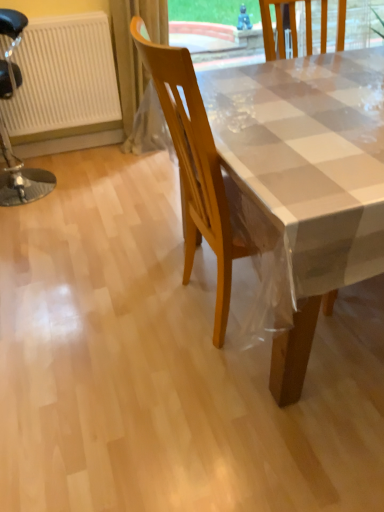
You are a GUI agent. You are given a task and a screenshot of the screen. Output one action in this format:
    pyautogui.click(x=<x>, y=<y>)
    Task: Click on the black leather stool at left, which is the 1th chair from left to right
    
    Given the screenshot: What is the action you would take?
    pyautogui.click(x=21, y=180)

Locate an element on the screen. The height and width of the screenshot is (512, 384). wooden chair at center, the first chair from the right is located at coordinates (192, 166).

The width and height of the screenshot is (384, 512). I want to click on white textured radiator at left, so click(63, 76).

Where is `black leather stool at left, which appears as the 1th chair when viewed from the back`? The width and height of the screenshot is (384, 512). black leather stool at left, which appears as the 1th chair when viewed from the back is located at coordinates (21, 180).

From the picture: Is wooden chair at center, the first chair from the right, to the left or to the right of black leather stool at left, placed as the 2th chair when sorted from front to back, in the image?

In the image, wooden chair at center, the first chair from the right, appears on the right side of black leather stool at left, placed as the 2th chair when sorted from front to back.

How many degrees apart are the facing directions of wooden chair at center, the second chair from the left, and black leather stool at left, placed as the 2th chair when sorted from front to back?

There is a 179-degree angle between the facing directions of wooden chair at center, the second chair from the left, and black leather stool at left, placed as the 2th chair when sorted from front to back.

Which is behind, wooden chair at center, which is counted as the second chair, starting from the back, or black leather stool at left, which is the 1th chair from left to right?

Positioned behind is black leather stool at left, which is the 1th chair from left to right.

Can we say wooden chair at center, the first chair from the right, lies outside black leather stool at left, which appears as the 1th chair when viewed from the back?

Indeed, wooden chair at center, the first chair from the right, is completely outside black leather stool at left, which appears as the 1th chair when viewed from the back.

Which is in front, point (55, 178) or point (202, 189)?

The point (202, 189) is in front.

From the image's perspective, is black leather stool at left, placed as the 2th chair when sorted from front to back, under wooden chair at center, which is counted as the second chair, starting from the back?

No, from the image's perspective, black leather stool at left, placed as the 2th chair when sorted from front to back, is not below wooden chair at center, which is counted as the second chair, starting from the back.

Looking at this image, can you confirm if black leather stool at left, positioned as the second chair in right-to-left order, is thinner than wooden chair at center, which is counted as the second chair, starting from the back?

Indeed, black leather stool at left, positioned as the second chair in right-to-left order, has a lesser width compared to wooden chair at center, which is counted as the second chair, starting from the back.

How much distance is there between black leather stool at left, which appears as the 1th chair when viewed from the back, and wooden chair at center, which is counted as the second chair, starting from the back?

They are 4.41 feet apart.

Is white textured radiator at left thinner than black leather stool at left, positioned as the second chair in right-to-left order?

Indeed, white textured radiator at left has a lesser width compared to black leather stool at left, positioned as the second chair in right-to-left order.

Can you confirm if white textured radiator at left is bigger than black leather stool at left, placed as the 2th chair when sorted from front to back?

Actually, white textured radiator at left might be smaller than black leather stool at left, placed as the 2th chair when sorted from front to back.

From a real-world perspective, is white textured radiator at left physically above black leather stool at left, which appears as the 1th chair when viewed from the back?

Yes, from a real-world perspective, white textured radiator at left is above black leather stool at left, which appears as the 1th chair when viewed from the back.

From the image's perspective, is white textured radiator at left under black leather stool at left, placed as the 2th chair when sorted from front to back?

No.

Which is behind, point (183, 274) or point (146, 83)?

The point (146, 83) is farther.

Is wooden chair at center, which is counted as the second chair, starting from the back, facing towards translucent plastic curtain at upper left?

No.

Is wooden chair at center, the first chair positioned from the front, to the left or to the right of translucent plastic curtain at upper left in the image?

From the image, it's evident that wooden chair at center, the first chair positioned from the front, is to the right of translucent plastic curtain at upper left.

Choose the correct answer: Is wooden chair at center, the second chair from the left, inside translucent plastic curtain at upper left or outside it?

wooden chair at center, the second chair from the left, is spatially situated outside translucent plastic curtain at upper left.

Is black leather stool at left, positioned as the second chair in right-to-left order, surrounded by translucent plastic curtain at upper left?

No, black leather stool at left, positioned as the second chair in right-to-left order, is not surrounded by translucent plastic curtain at upper left.

From a real-world perspective, is translucent plastic curtain at upper left physically above black leather stool at left, positioned as the second chair in right-to-left order?

Incorrect, from a real-world perspective, translucent plastic curtain at upper left is lower than black leather stool at left, positioned as the second chair in right-to-left order.

Which of these two, translucent plastic curtain at upper left or black leather stool at left, which is the 1th chair from left to right, stands taller?

Standing taller between the two is black leather stool at left, which is the 1th chair from left to right.

Does translucent plastic curtain at upper left touch black leather stool at left, positioned as the second chair in right-to-left order?

No, translucent plastic curtain at upper left is not making contact with black leather stool at left, positioned as the second chair in right-to-left order.

Looking at this image, is wooden chair at center, which is counted as the second chair, starting from the back, oriented away from white textured radiator at left?

No, white textured radiator at left is not at the back of wooden chair at center, which is counted as the second chair, starting from the back.

Is wooden chair at center, the second chair from the left, situated inside white textured radiator at left or outside?

wooden chair at center, the second chair from the left, exists outside the volume of white textured radiator at left.

From the picture: Is wooden chair at center, the second chair from the left, to the left of white textured radiator at left from the viewer's perspective?

Incorrect, wooden chair at center, the second chair from the left, is not on the left side of white textured radiator at left.

Looking at this image, can you tell me how much wooden chair at center, the second chair from the left, and white textured radiator at left differ in facing direction?

The angular difference between wooden chair at center, the second chair from the left, and white textured radiator at left is 93.4 degrees.

Considering their positions, is black leather stool at left, positioned as the second chair in right-to-left order, located in front of or behind white textured radiator at left?

Clearly, black leather stool at left, positioned as the second chair in right-to-left order, is in front of white textured radiator at left.

From the picture: Measure the distance between black leather stool at left, positioned as the second chair in right-to-left order, and white textured radiator at left.

black leather stool at left, positioned as the second chair in right-to-left order, is 17.71 inches away from white textured radiator at left.

Considering the sizes of objects black leather stool at left, placed as the 2th chair when sorted from front to back, and white textured radiator at left in the image provided, who is bigger, black leather stool at left, placed as the 2th chair when sorted from front to back, or white textured radiator at left?

Bigger between the two is black leather stool at left, placed as the 2th chair when sorted from front to back.

Which object is wider, black leather stool at left, which appears as the 1th chair when viewed from the back, or white textured radiator at left?

Wider between the two is black leather stool at left, which appears as the 1th chair when viewed from the back.

Where is `chair on the left of wooden chair at center, the first chair positioned from the front`? The image size is (384, 512). chair on the left of wooden chair at center, the first chair positioned from the front is located at coordinates (21, 180).

Identify the location of chair that is behind the wooden chair at center, the first chair positioned from the front. The height and width of the screenshot is (512, 384). (21, 180).

In the scene shown: Which object lies further to the anchor point translucent plastic curtain at upper left, wooden chair at center, the first chair from the right, or black leather stool at left, which is the 1th chair from left to right?

wooden chair at center, the first chair from the right.

From the image, which object appears to be nearer to white textured radiator at left, black leather stool at left, placed as the 2th chair when sorted from front to back, or translucent plastic curtain at upper left?

translucent plastic curtain at upper left is closer to white textured radiator at left.

Which object lies further to the anchor point black leather stool at left, which appears as the 1th chair when viewed from the back, translucent plastic curtain at upper left or white textured radiator at left?

The object further to black leather stool at left, which appears as the 1th chair when viewed from the back, is translucent plastic curtain at upper left.

Based on their spatial positions, is translucent plastic curtain at upper left or black leather stool at left, which appears as the 1th chair when viewed from the back, further from wooden chair at center, the first chair from the right?

Based on the image, black leather stool at left, which appears as the 1th chair when viewed from the back, appears to be further to wooden chair at center, the first chair from the right.

Based on their spatial positions, is translucent plastic curtain at upper left or wooden chair at center, the first chair from the right, further from white textured radiator at left?

wooden chair at center, the first chair from the right, is positioned further to the anchor white textured radiator at left.

Considering their positions, is black leather stool at left, which appears as the 1th chair when viewed from the back, positioned closer to white textured radiator at left than wooden chair at center, which is counted as the second chair, starting from the back?

black leather stool at left, which appears as the 1th chair when viewed from the back, is closer to white textured radiator at left.

In the scene shown: Based on their spatial positions, is white textured radiator at left or black leather stool at left, which is the 1th chair from left to right, further from translucent plastic curtain at upper left?

Based on the image, black leather stool at left, which is the 1th chair from left to right, appears to be further to translucent plastic curtain at upper left.

When comparing their distances from black leather stool at left, placed as the 2th chair when sorted from front to back, does translucent plastic curtain at upper left or wooden chair at center, the second chair from the left, seem closer?

The object closer to black leather stool at left, placed as the 2th chair when sorted from front to back, is translucent plastic curtain at upper left.

What are the coordinates of `radiator positioned between wooden chair at center, the first chair positioned from the front, and translucent plastic curtain at upper left from near to far` in the screenshot? It's located at (63, 76).

Where is `chair between wooden chair at center, the second chair from the left, and translucent plastic curtain at upper left in the front-back direction`? chair between wooden chair at center, the second chair from the left, and translucent plastic curtain at upper left in the front-back direction is located at coordinates click(21, 180).

What are the coordinates of `chair between wooden chair at center, which is counted as the second chair, starting from the back, and white textured radiator at left from front to back` in the screenshot? It's located at point(21,180).

This screenshot has width=384, height=512. Identify the location of radiator between black leather stool at left, positioned as the second chair in right-to-left order, and translucent plastic curtain at upper left from left to right. (63, 76).